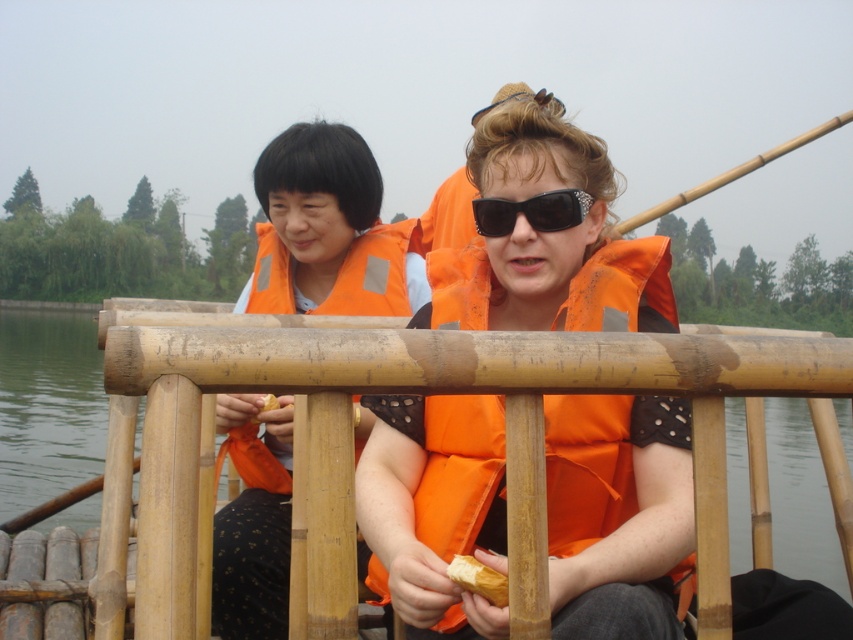
Is orange fabric life jacket at center thinner than black textured sunglasses at center?

No, orange fabric life jacket at center is not thinner than black textured sunglasses at center.

Is orange fabric life jacket at center smaller than black textured sunglasses at center?

Incorrect, orange fabric life jacket at center is not smaller in size than black textured sunglasses at center.

Which is in front, point (260, 252) or point (535, 220)?

Positioned in front is point (535, 220).

This screenshot has width=853, height=640. What are the coordinates of `orange fabric life jacket at center` in the screenshot? It's located at (375, 273).

Based on the photo, can you confirm if orange life vest at left is bigger than orange fabric life jacket at center?

Yes, orange life vest at left is bigger than orange fabric life jacket at center.

Which is below, orange life vest at left or orange fabric life jacket at center?

orange fabric life jacket at center is lower down.

Does point (341, 163) come behind point (265, 288)?

No, it is not.

What are the coordinates of `orange life vest at left` in the screenshot? It's located at (328, 230).

Is orange life vest at center positioned at the back of orange fabric life jacket at center?

No.

Which is behind, point (599, 499) or point (276, 308)?

Point (276, 308)

Which is behind, point (511, 236) or point (376, 257)?

Positioned behind is point (376, 257).

At what (x,y) coordinates should I click in order to perform the action: click on orange life vest at center. Please return your answer as a coordinate pair (x, y). Looking at the image, I should click on (546, 240).